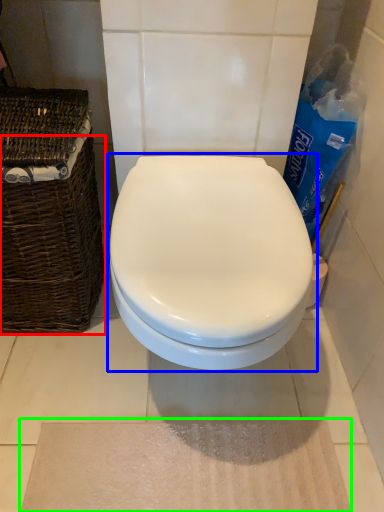
Question: Based on their relative distances, which object is nearer to basket (highlighted by a red box)? Choose from toilet (highlighted by a blue box) and bath mat (highlighted by a green box).

Choices:
 (A) toilet
 (B) bath mat

Answer: (A)